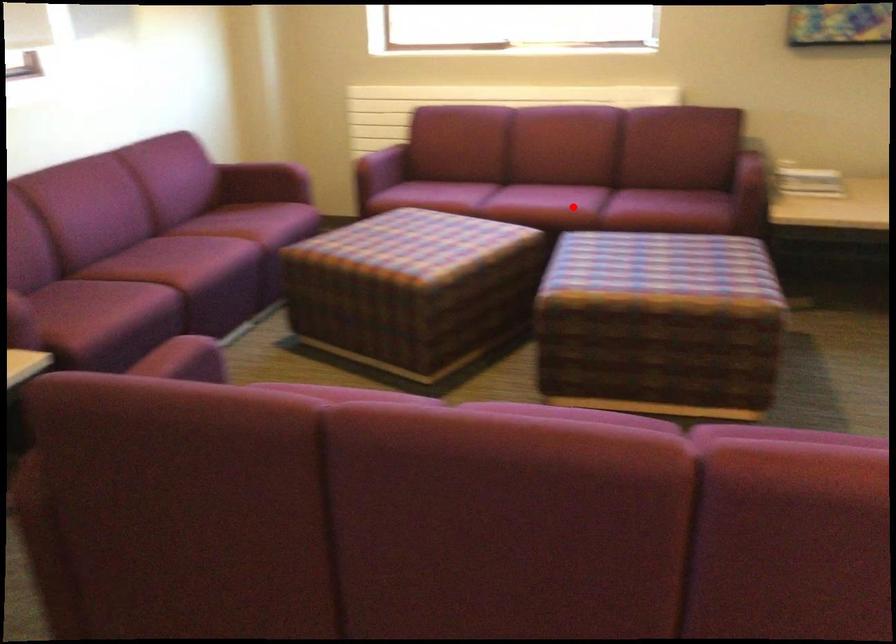
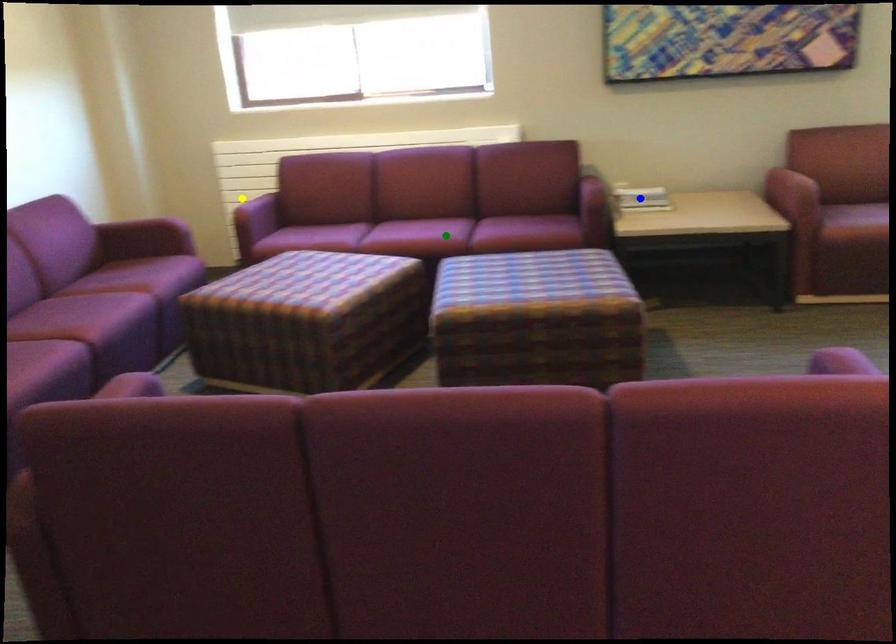
Question: I am providing you with two images of the same scene from different viewpoints. A red point is marked on the first image. You are given multiple points on the second image. Which point in image 2 is actually the same real-world point as the red point in image 1?

Choices:
 (A) green point
 (B) yellow point
 (C) blue point

Answer: (A)